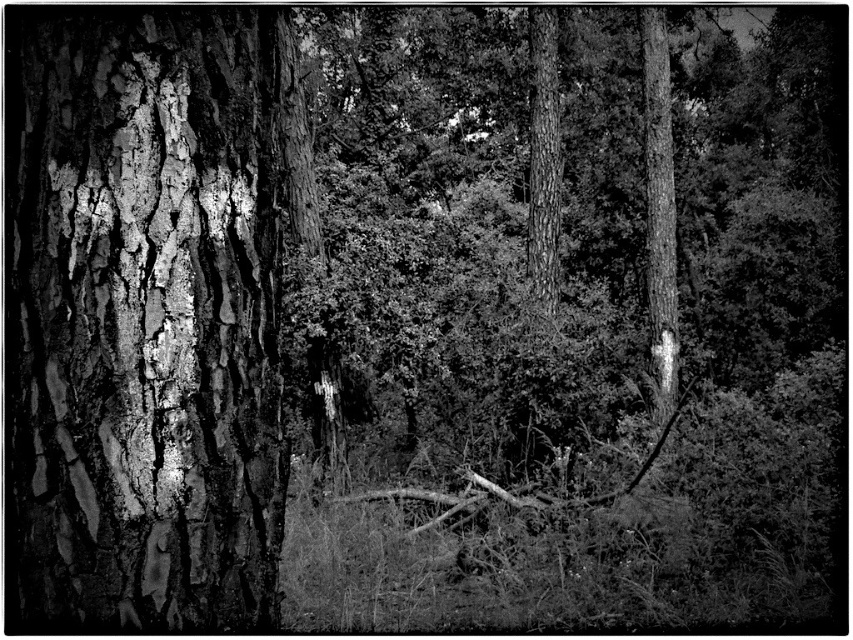
Question: Does cracked bark tree trunk at left appear under smooth bark tree trunk at right?

Choices:
 (A) yes
 (B) no

Answer: (A)

Question: Does cracked bark tree trunk at left appear on the left side of smooth bark tree trunk at right?

Choices:
 (A) no
 (B) yes

Answer: (B)

Question: Does cracked bark tree trunk at left appear over smooth bark tree trunk at right?

Choices:
 (A) yes
 (B) no

Answer: (B)

Question: Which of the following is the closest to the observer?

Choices:
 (A) (666, 122)
 (B) (221, 476)

Answer: (B)